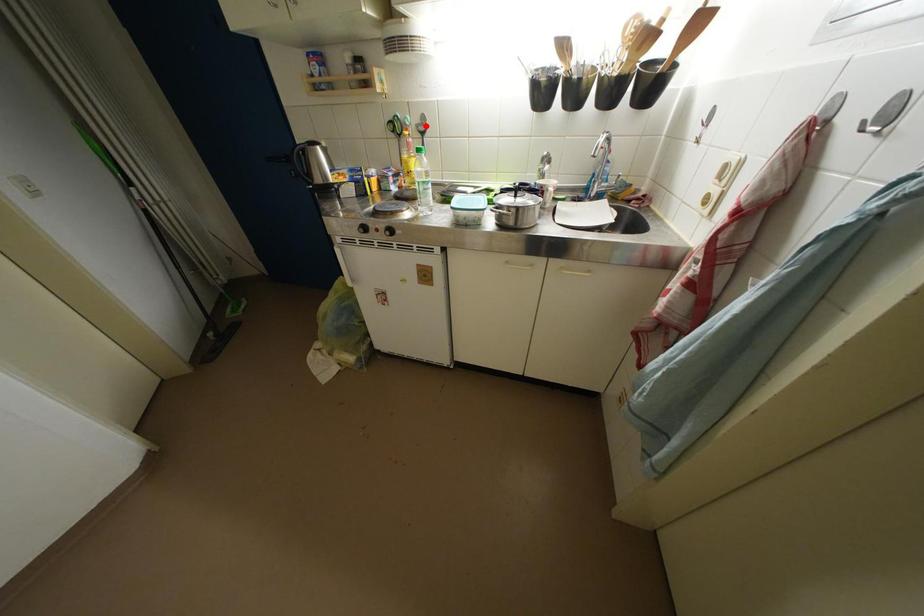
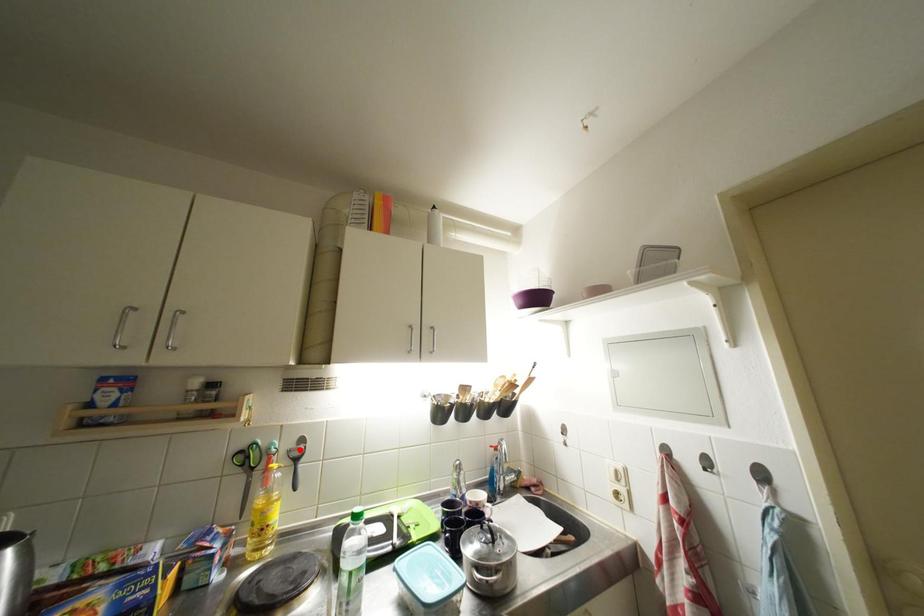
Based on the photo, I am providing you with two images of the same scene from different viewpoints. A red point is marked on the first image and another point is marked on the second image. Is the red point in image1 aligned with the point shown in image2?

Yes